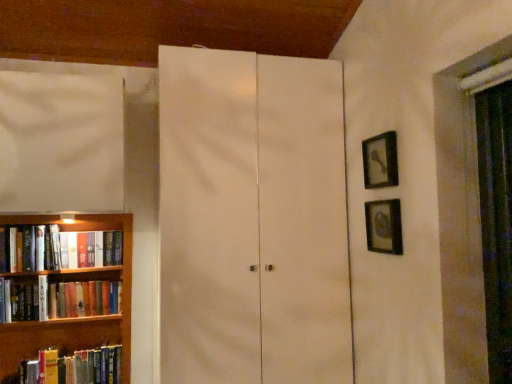
The width and height of the screenshot is (512, 384). What are the coordinates of `wooden bookshelf at left` in the screenshot? It's located at (82, 318).

Describe the element at coordinates (82, 318) in the screenshot. I see `wooden bookshelf at left` at that location.

Describe the element at coordinates (380, 161) in the screenshot. I see `black matte picture frame at upper right, which ranks as the second picture frame in bottom-to-top order` at that location.

Measure the distance between point (44, 235) and camera.

Point (44, 235) and camera are 2.29 meters apart.

Measure the distance between metallic silver picture frame at right, which ranks as the first picture frame in bottom-to-top order, and camera.

metallic silver picture frame at right, which ranks as the first picture frame in bottom-to-top order, is 5.94 feet away from camera.

The height and width of the screenshot is (384, 512). Find the location of `hardcover book at left, the second book when ordered from bottom to top`. hardcover book at left, the second book when ordered from bottom to top is located at coordinates (91, 249).

Locate an element on the screen. The height and width of the screenshot is (384, 512). wooden bookshelf at left is located at coordinates 82,318.

Consider the image. Which object is closer to the camera, metallic silver picture frame at right, which ranks as the first picture frame in bottom-to-top order, or wooden bookshelf at left?

Positioned in front is metallic silver picture frame at right, which ranks as the first picture frame in bottom-to-top order.

Could you tell me if metallic silver picture frame at right, which ranks as the first picture frame in bottom-to-top order, is facing wooden bookshelf at left?

No, metallic silver picture frame at right, which ranks as the first picture frame in bottom-to-top order, is not turned towards wooden bookshelf at left.

Can you confirm if metallic silver picture frame at right, which ranks as the first picture frame in bottom-to-top order, is wider than wooden bookshelf at left?

Incorrect, the width of metallic silver picture frame at right, which ranks as the first picture frame in bottom-to-top order, does not surpass that of wooden bookshelf at left.

Is point (220, 279) positioned before point (41, 320)?

Yes.

Is the depth of white matte cabinet at center greater than that of hardcover book at left, the third book viewed from the top?

No, white matte cabinet at center is closer to the camera.

From their relative heights in the image, would you say white matte cabinet at center is taller or shorter than hardcover book at left, the third book viewed from the top?

In the image, white matte cabinet at center appears to be taller than hardcover book at left, the third book viewed from the top.

Identify the location of cupboard above the hardcover book at left, the third book viewed from the top (from a real-world perspective). Image resolution: width=512 pixels, height=384 pixels. (252, 219).

From the image's perspective, is wooden bookshelf at left on white matte cabinet at center?

No, from the image's perspective, wooden bookshelf at left is not over white matte cabinet at center.

Is wooden bookshelf at left thinner than white matte cabinet at center?

Indeed, wooden bookshelf at left has a lesser width compared to white matte cabinet at center.

Is wooden bookshelf at left placed right next to white matte cabinet at center?

No.

Considering the positions of points (2, 327) and (189, 267), is point (2, 327) farther from camera compared to point (189, 267)?

Yes.

From a real-world perspective, which object stands above the other?

metallic silver picture frame at right, which ranks as the first picture frame in bottom-to-top order, is physically above.

Is hardcover book at left, the second book when ordered from bottom to top, further to the viewer compared to metallic silver picture frame at right, the 2th picture frame in the top-to-bottom sequence?

Yes, hardcover book at left, the second book when ordered from bottom to top, is further from the viewer.

Which book is the 3rd one when counting from the back of the metallic silver picture frame at right, the 2th picture frame in the top-to-bottom sequence? Please provide its 2D coordinates.

[(91, 249)]

Consider the image. In terms of height, does hardcover book at left, which is the second book in top-to-bottom order, look taller or shorter compared to metallic silver picture frame at right, the 2th picture frame in the top-to-bottom sequence?

Clearly, hardcover book at left, which is the second book in top-to-bottom order, is shorter compared to metallic silver picture frame at right, the 2th picture frame in the top-to-bottom sequence.

Could you tell me if white matte cabinet at center is turned towards metallic silver picture frame at right, the 2th picture frame in the top-to-bottom sequence?

Yes, white matte cabinet at center is turned towards metallic silver picture frame at right, the 2th picture frame in the top-to-bottom sequence.

Is white matte cabinet at center beside metallic silver picture frame at right, which ranks as the first picture frame in bottom-to-top order?

No, white matte cabinet at center is not with metallic silver picture frame at right, which ranks as the first picture frame in bottom-to-top order.

From the image's perspective, is white matte cabinet at center beneath metallic silver picture frame at right, the 2th picture frame in the top-to-bottom sequence?

Yes.

In the scene shown: Which is more to the right, white matte cabinet at center or metallic silver picture frame at right, the 2th picture frame in the top-to-bottom sequence?

From the viewer's perspective, metallic silver picture frame at right, the 2th picture frame in the top-to-bottom sequence, appears more on the right side.

Which is more to the right, white matte cabinet at center or wooden bookshelf at left?

white matte cabinet at center is more to the right.

Are white matte cabinet at center and wooden bookshelf at left far apart?

That's not correct — white matte cabinet at center is a little close to wooden bookshelf at left.

From the image's perspective, is white matte cabinet at center located above wooden bookshelf at left?

Correct, white matte cabinet at center appears higher than wooden bookshelf at left in the image.

Is wooden bookshelf at left located within white matte cabinet at center?

No, wooden bookshelf at left is not surrounded by white matte cabinet at center.

Is metallic silver picture frame at right, the 2th picture frame in the top-to-bottom sequence, inside or outside of black matte picture frame at upper right, the 1th picture frame from the top?

metallic silver picture frame at right, the 2th picture frame in the top-to-bottom sequence, is spatially situated outside black matte picture frame at upper right, the 1th picture frame from the top.

Is metallic silver picture frame at right, the 2th picture frame in the top-to-bottom sequence, to the left of black matte picture frame at upper right, which ranks as the second picture frame in bottom-to-top order, from the viewer's perspective?

No.

Is metallic silver picture frame at right, which ranks as the first picture frame in bottom-to-top order, facing away from black matte picture frame at upper right, the 1th picture frame from the top?

No, black matte picture frame at upper right, the 1th picture frame from the top, is not at the back of metallic silver picture frame at right, which ranks as the first picture frame in bottom-to-top order.

Looking at their sizes, would you say metallic silver picture frame at right, the 2th picture frame in the top-to-bottom sequence, is wider or thinner than black matte picture frame at upper right, which ranks as the second picture frame in bottom-to-top order?

Considering their sizes, metallic silver picture frame at right, the 2th picture frame in the top-to-bottom sequence, looks slimmer than black matte picture frame at upper right, which ranks as the second picture frame in bottom-to-top order.

In order to click on picture frame that is the 1st object above the wooden bookshelf at left (from a real-world perspective) in this screenshot , I will do `click(384, 226)`.

I want to click on the 3rd book below when counting from the white matte cabinet at center (from the image's perspective), so click(x=57, y=299).

Looking at this image, based on their spatial positions, is hardcover book at left, the third book viewed from the top, or white matte cabinet at center further from hardcover book at left, positioned as the 3th book in bottom-to-top order?

Based on the image, white matte cabinet at center appears to be further to hardcover book at left, positioned as the 3th book in bottom-to-top order.

From the image, which object appears to be nearer to hardcover book at left, which is the second book in top-to-bottom order, black matte picture frame at upper right, the 1th picture frame from the top, or hardcover book at left, positioned as the 3th book in bottom-to-top order?

The object closer to hardcover book at left, which is the second book in top-to-bottom order, is hardcover book at left, positioned as the 3th book in bottom-to-top order.

When comparing their distances from hardcover book at left, which is the 1th book from bottom to top, does black matte picture frame at upper right, the 1th picture frame from the top, or metallic silver picture frame at right, the 2th picture frame in the top-to-bottom sequence, seem further?

Among the two, black matte picture frame at upper right, the 1th picture frame from the top, is located further to hardcover book at left, which is the 1th book from bottom to top.

Considering their positions, is wooden bookshelf at left positioned closer to metallic silver picture frame at right, the 2th picture frame in the top-to-bottom sequence, than black matte picture frame at upper right, the 1th picture frame from the top?

Among the two, black matte picture frame at upper right, the 1th picture frame from the top, is located nearer to metallic silver picture frame at right, the 2th picture frame in the top-to-bottom sequence.

Estimate the real-world distances between objects in this image. Which object is further from black matte picture frame at upper right, which ranks as the second picture frame in bottom-to-top order, metallic silver picture frame at right, which ranks as the first picture frame in bottom-to-top order, or hardcover book at left, the second book when ordered from bottom to top?

hardcover book at left, the second book when ordered from bottom to top, is further to black matte picture frame at upper right, which ranks as the second picture frame in bottom-to-top order.

Considering their positions, is white matte cabinet at center positioned further to black matte picture frame at upper right, which ranks as the second picture frame in bottom-to-top order, than hardcover book at left, positioned as the 3th book in bottom-to-top order?

hardcover book at left, positioned as the 3th book in bottom-to-top order.

Looking at the image, which one is located closer to hardcover book at left, which is the second book in top-to-bottom order, metallic silver picture frame at right, which ranks as the first picture frame in bottom-to-top order, or black matte picture frame at upper right, which ranks as the second picture frame in bottom-to-top order?

metallic silver picture frame at right, which ranks as the first picture frame in bottom-to-top order, is positioned closer to the anchor hardcover book at left, which is the second book in top-to-bottom order.

Considering their positions, is black matte picture frame at upper right, the 1th picture frame from the top, positioned further to white matte cabinet at center than hardcover book at left, the second book when ordered from bottom to top?

hardcover book at left, the second book when ordered from bottom to top.

Where is `picture frame situated between hardcover book at left, the second book when ordered from bottom to top, and metallic silver picture frame at right, which ranks as the first picture frame in bottom-to-top order, from left to right`? The height and width of the screenshot is (384, 512). picture frame situated between hardcover book at left, the second book when ordered from bottom to top, and metallic silver picture frame at right, which ranks as the first picture frame in bottom-to-top order, from left to right is located at coordinates (380, 161).

You are a GUI agent. You are given a task and a screenshot of the screen. Output one action in this format:
    pyautogui.click(x=<x>, y=<y>)
    Task: Click on the book that lies between hardcover book at left, the second book when ordered from bottom to top, and wooden bookshelf at left from top to bottom
    This screenshot has height=384, width=512.
    Given the screenshot: What is the action you would take?
    pyautogui.click(x=57, y=299)

Find the location of a particular element. book between hardcover book at left, which is the 1th book from bottom to top, and black matte picture frame at upper right, which ranks as the second picture frame in bottom-to-top order, in the horizontal direction is located at coordinates (91, 249).

This screenshot has height=384, width=512. Identify the location of cupboard located between hardcover book at left, which is the second book in top-to-bottom order, and black matte picture frame at upper right, the 1th picture frame from the top, in the left-right direction. (252, 219).